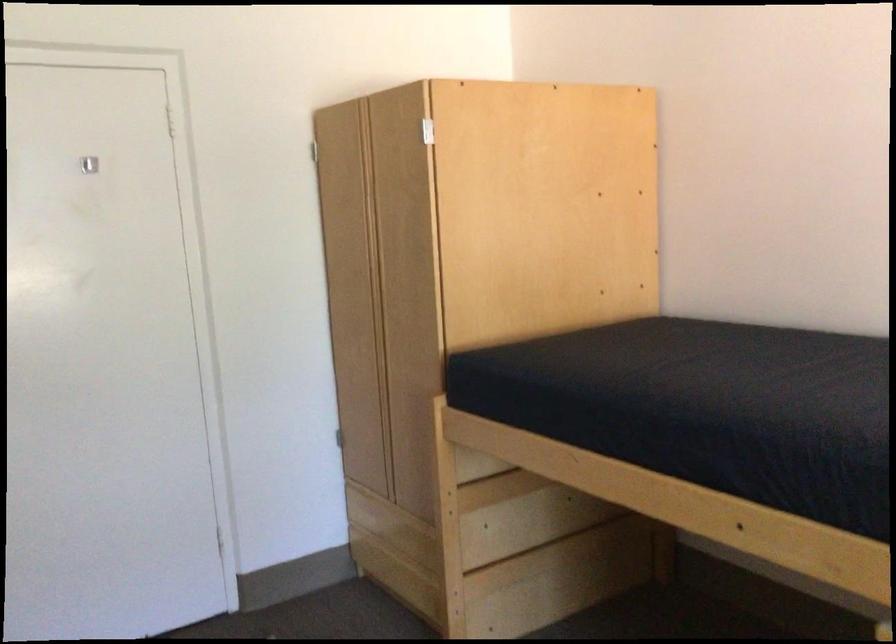
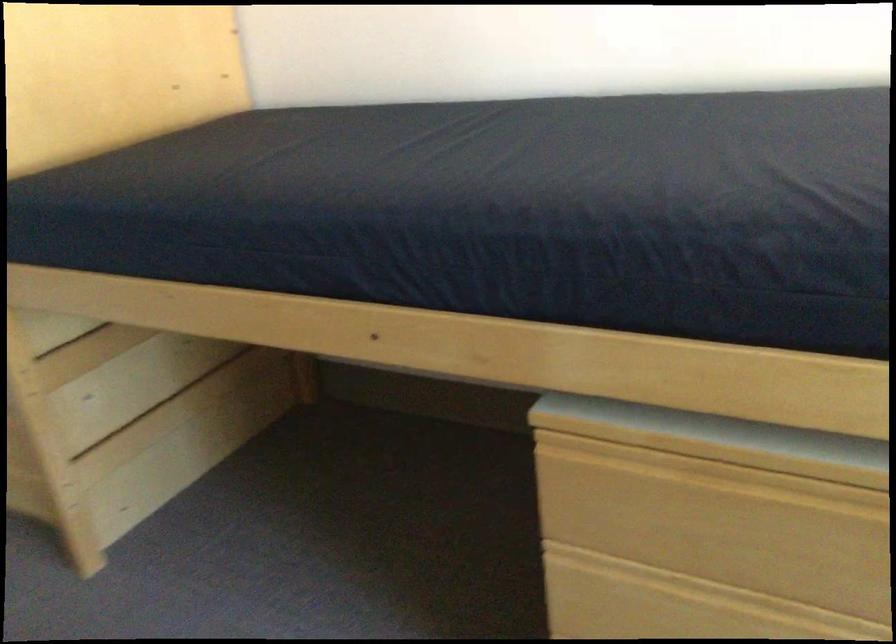
Question: The first image is from the beginning of the video and the second image is from the end. How did the camera likely rotate when shooting the video?

Choices:
 (A) Left
 (B) Right
 (C) Up
 (D) Down

Answer: (B)